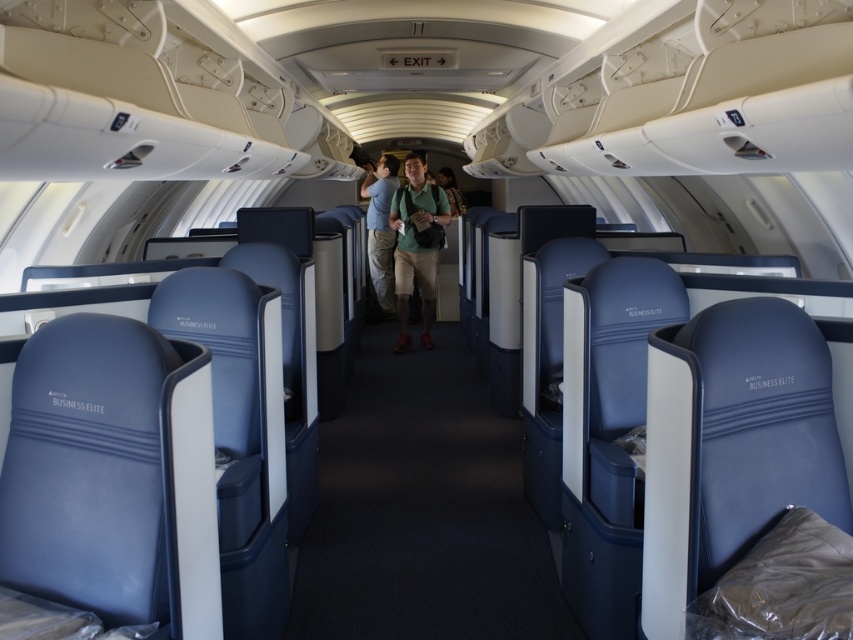
Question: From the image, what is the correct spatial relationship of green fabric shirt at center in relation to matte blue shirt at center?

Choices:
 (A) right
 (B) left

Answer: (A)

Question: Is green fabric shirt at center below matte blue shirt at center?

Choices:
 (A) no
 (B) yes

Answer: (B)

Question: Among these objects, which one is nearest to the camera?

Choices:
 (A) green fabric shirt at center
 (B) matte blue shirt at center

Answer: (A)

Question: Which object is closer to the camera taking this photo?

Choices:
 (A) green fabric shirt at center
 (B) matte blue shirt at center

Answer: (A)

Question: Can you confirm if green fabric shirt at center is positioned above matte blue shirt at center?

Choices:
 (A) yes
 (B) no

Answer: (B)